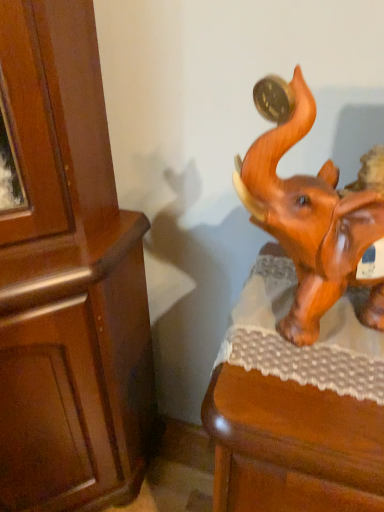
The height and width of the screenshot is (512, 384). Describe the element at coordinates (309, 213) in the screenshot. I see `shiny brown elephant at right` at that location.

Find the location of `shiny brown elephant at right`. shiny brown elephant at right is located at coordinates (309, 213).

Find the location of `shiny brown elephant at right`. shiny brown elephant at right is located at coordinates pos(309,213).